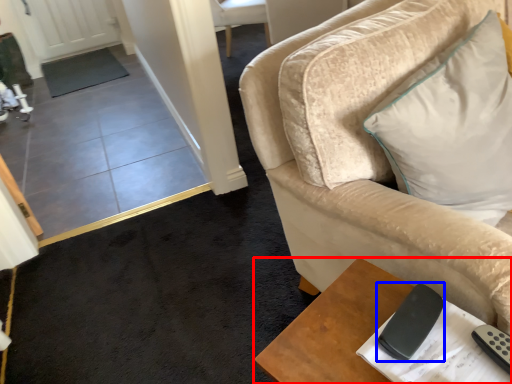
Question: Which object is further to the camera taking this photo, table (highlighted by a red box) or remote (highlighted by a blue box)?

Choices:
 (A) table
 (B) remote

Answer: (B)